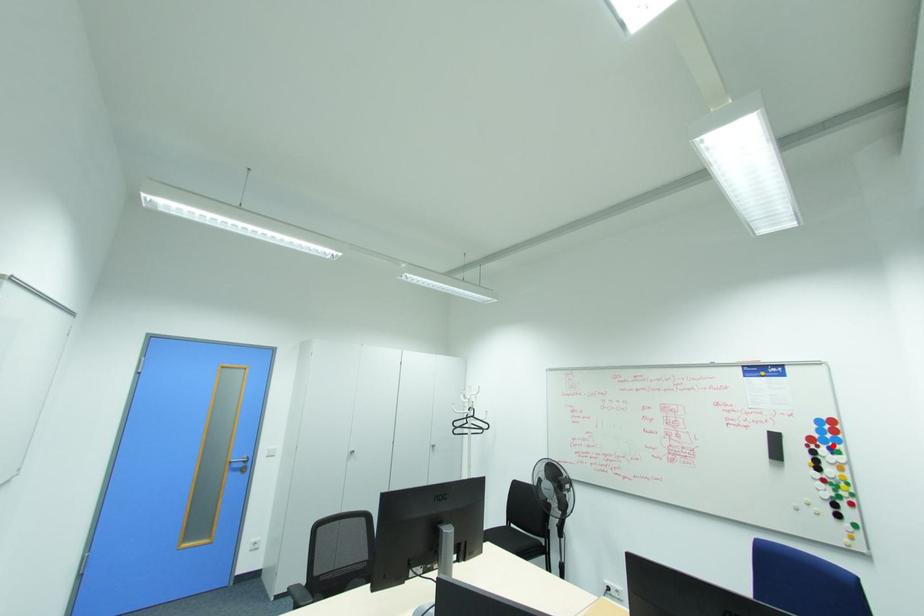
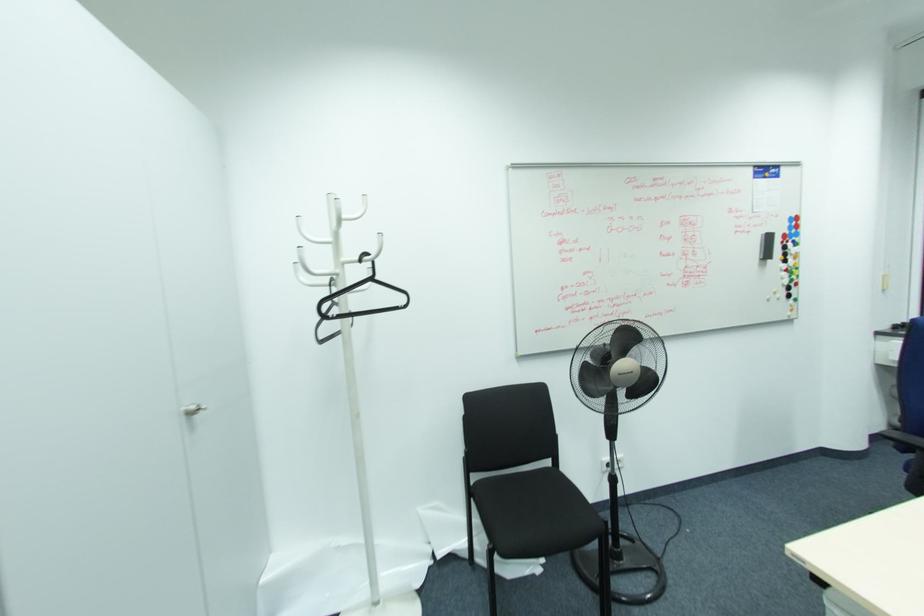
In the second image, find the point that corresponds to the highlighted location in the first image.

(796, 238)